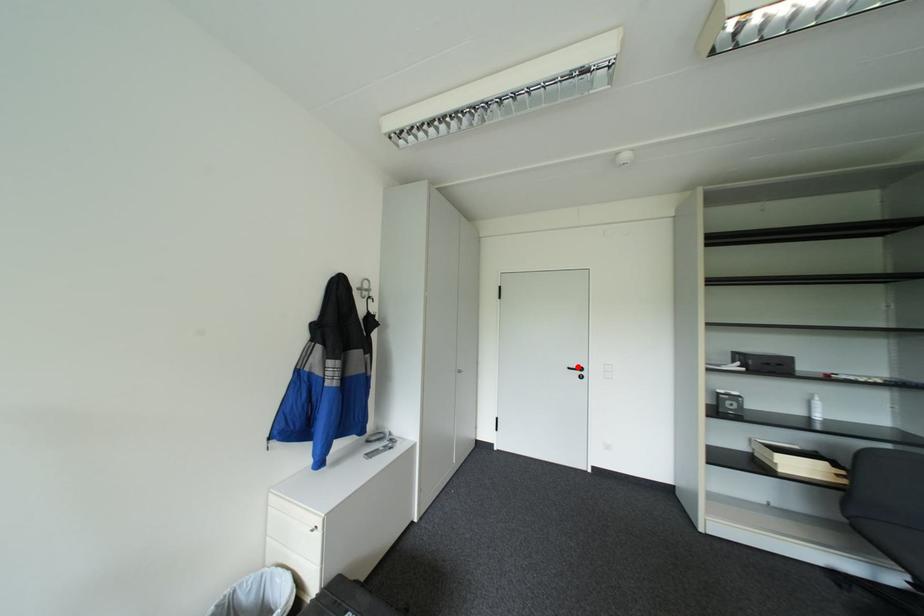
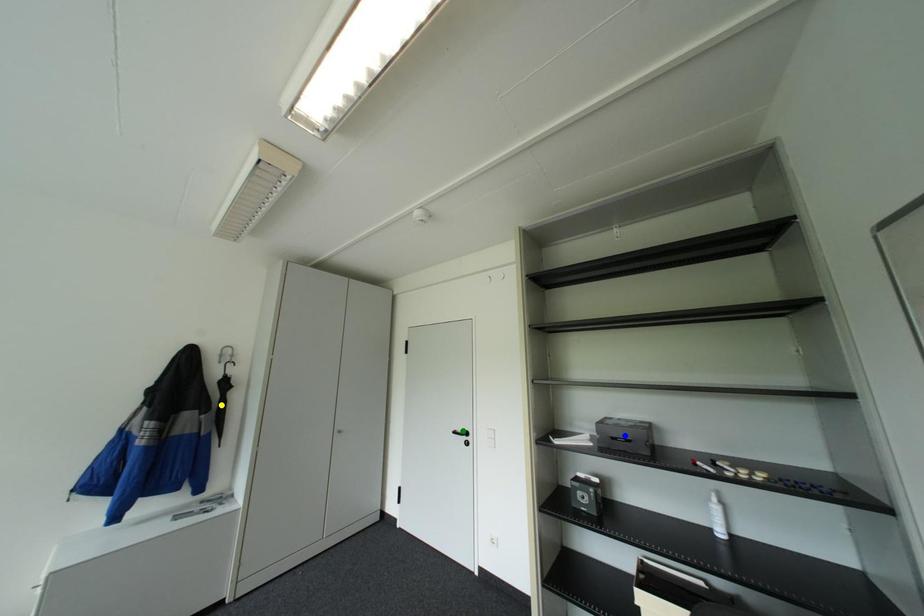
Question: I am providing you with two images of the same scene from different viewpoints. A red point is marked on the first image. You are given multiple points on the second image. Which point in image 2 is actually the same real-world point as the red point in image 1?

Choices:
 (A) yellow point
 (B) blue point
 (C) green point

Answer: (C)